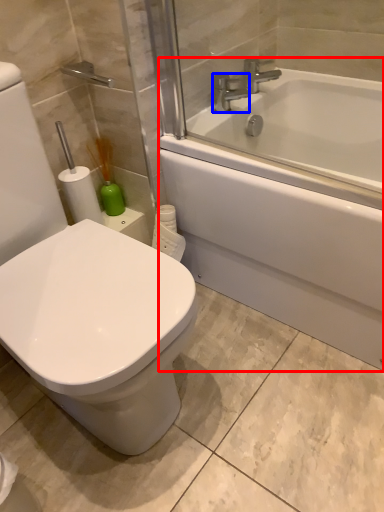
Question: Which point is further to the camera, bathtub (highlighted by a red box) or faucet (highlighted by a blue box)?

Choices:
 (A) bathtub
 (B) faucet

Answer: (B)